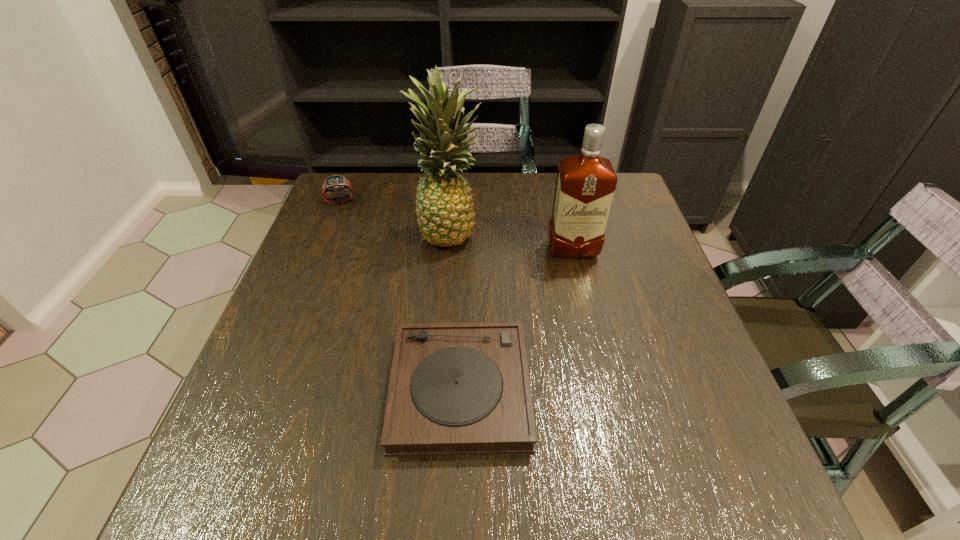
The image size is (960, 540). I want to click on empty location between the tallest object and the rightmost object, so click(512, 241).

Identify the location of empty space that is in between the third shortest object and the nearest object. (516, 320).

Image resolution: width=960 pixels, height=540 pixels. Find the location of `object that stands as the second closest to the leftmost object`. object that stands as the second closest to the leftmost object is located at coordinates (455, 388).

Identify which object is located as the second nearest to the leftmost object. Please provide its 2D coordinates. Your answer should be formatted as a tuple, i.e. [(x, y)], where the tuple contains the x and y coordinates of a point satisfying the conditions above.

[(455, 388)]